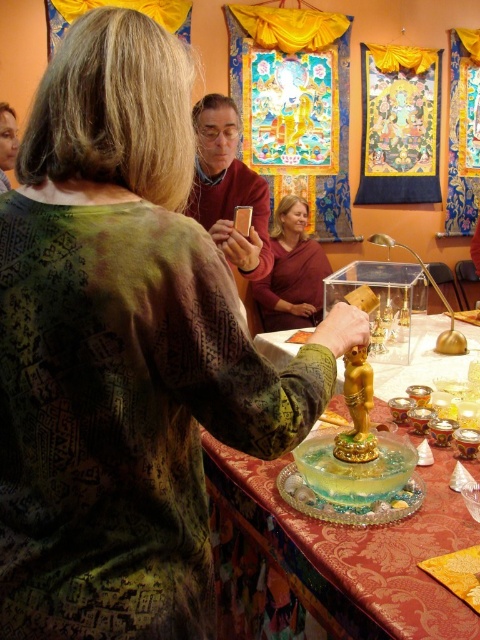
In the temple scene, there are two statues on the table covered with a red cloth. The statues are labeled as the translucent glass statue at center and the matte brown statue at center. Which of these two statues is larger?

The translucent glass statue at center is bigger than the matte brown statue at center.

You are a visitor in this temple and you see both the translucent glass statue at center and the translucent gelatinous cake at center on the table. Which object is placed higher on the table?

The translucent glass statue at center is positioned over the translucent gelatinous cake at center, so the statue is higher than the cake.